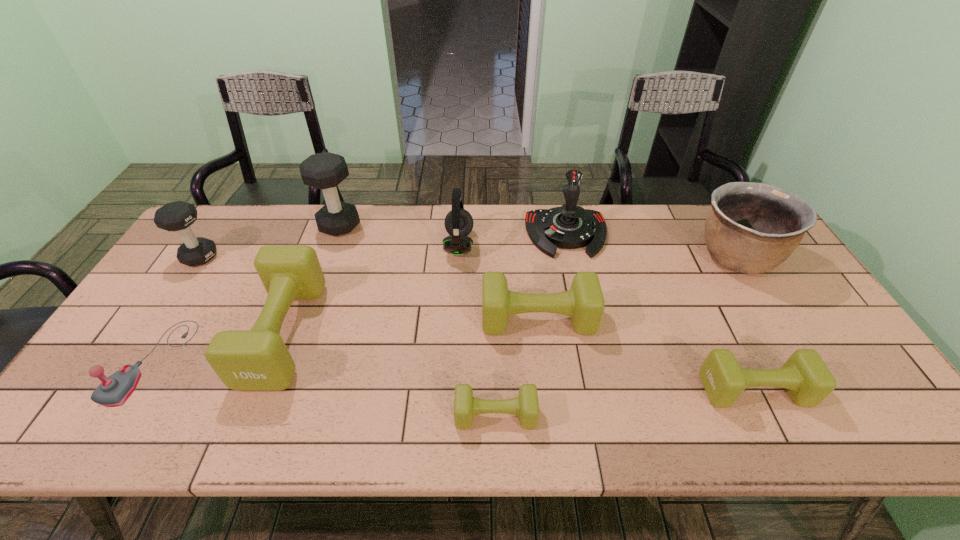
Identify the location of free space at the left edge of the desktop. (157, 328).

In the image, there is a desktop. Where is `vacant space at the right edge`? The image size is (960, 540). vacant space at the right edge is located at coordinates (765, 308).

Identify the location of free spot at the far left corner of the desktop. The height and width of the screenshot is (540, 960). (220, 245).

Identify the location of free region at the near left corner of the desktop. (135, 413).

Find the location of a particular element. This screenshot has height=540, width=960. vacant area that lies between the pottery and the leftmost dumbbell is located at coordinates (468, 257).

Locate an element on the screen. vacant area that lies between the fourth shortest object and the rightmost dumbbell is located at coordinates (646, 355).

Where is `empty space between the nearer gray dumbbell and the rightmost dumbbell`? The width and height of the screenshot is (960, 540). empty space between the nearer gray dumbbell and the rightmost dumbbell is located at coordinates (477, 323).

You are a GUI agent. You are given a task and a screenshot of the screen. Output one action in this format:
    pyautogui.click(x=<x>, y=<y>)
    Task: Click on the free area in between the fourth shortest dumbbell and the smallest olive dumbbell
    This screenshot has width=960, height=540.
    Given the screenshot: What is the action you would take?
    pyautogui.click(x=390, y=374)

Image resolution: width=960 pixels, height=540 pixels. I want to click on free spot between the second biggest olive dumbbell and the left joystick, so click(x=345, y=340).

Locate an element on the screen. The width and height of the screenshot is (960, 540). vacant space that's between the nearer gray dumbbell and the fourth tallest dumbbell is located at coordinates (369, 288).